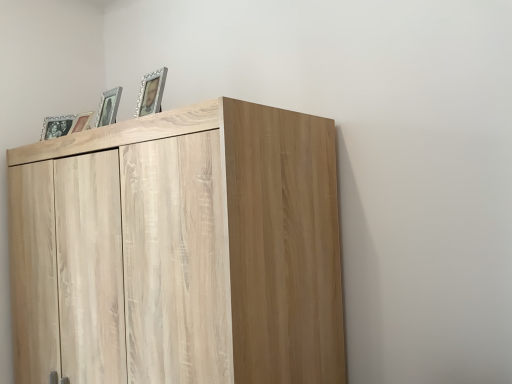
Question: Does light wood cupboard at upper left appear on the right side of matte silver picture frame at upper left, which ranks as the 2th picture frame in front-to-back order?

Choices:
 (A) yes
 (B) no

Answer: (A)

Question: Is light wood cupboard at upper left taller than matte silver picture frame at upper left, which appears as the third picture frame when viewed from the back?

Choices:
 (A) yes
 (B) no

Answer: (A)

Question: From the image's perspective, is light wood cupboard at upper left over matte silver picture frame at upper left, which appears as the third picture frame when viewed from the back?

Choices:
 (A) yes
 (B) no

Answer: (B)

Question: From a real-world perspective, is light wood cupboard at upper left under matte silver picture frame at upper left, the second picture frame positioned from the right?

Choices:
 (A) no
 (B) yes

Answer: (B)

Question: Is light wood cupboard at upper left at the left side of matte silver picture frame at upper left, which appears as the third picture frame when viewed from the back?

Choices:
 (A) no
 (B) yes

Answer: (A)

Question: Could you tell me if light wood cupboard at upper left is facing matte silver picture frame at upper left, the second picture frame positioned from the right?

Choices:
 (A) yes
 (B) no

Answer: (B)

Question: Is matte wooden picture frame at upper left, the 3th picture frame when ordered from right to left, placed right next to matte silver picture frame at upper left, the 3th picture frame when ordered from left to right?

Choices:
 (A) yes
 (B) no

Answer: (B)

Question: From a real-world perspective, is matte wooden picture frame at upper left, which is the 2th picture frame from left to right, beneath matte silver picture frame at upper left, which appears as the third picture frame when viewed from the back?

Choices:
 (A) yes
 (B) no

Answer: (A)

Question: From a real-world perspective, is matte wooden picture frame at upper left, the 3th picture frame when ordered from right to left, over matte silver picture frame at upper left, which appears as the third picture frame when viewed from the back?

Choices:
 (A) yes
 (B) no

Answer: (B)

Question: Would you say matte silver picture frame at upper left, the 3th picture frame when ordered from left to right, is part of matte wooden picture frame at upper left, which is the 2th picture frame from left to right,'s contents?

Choices:
 (A) yes
 (B) no

Answer: (B)

Question: Is matte wooden picture frame at upper left, which appears as the second picture frame when viewed from the back, looking in the opposite direction of matte silver picture frame at upper left, which appears as the third picture frame when viewed from the back?

Choices:
 (A) no
 (B) yes

Answer: (A)

Question: Is matte wooden picture frame at upper left, the 3th picture frame positioned from the front, shorter than matte silver picture frame at upper left, which appears as the third picture frame when viewed from the back?

Choices:
 (A) yes
 (B) no

Answer: (A)

Question: Is matte wooden picture frame at upper left, the 3th picture frame positioned from the front, smaller than light wood cupboard at upper left?

Choices:
 (A) no
 (B) yes

Answer: (B)